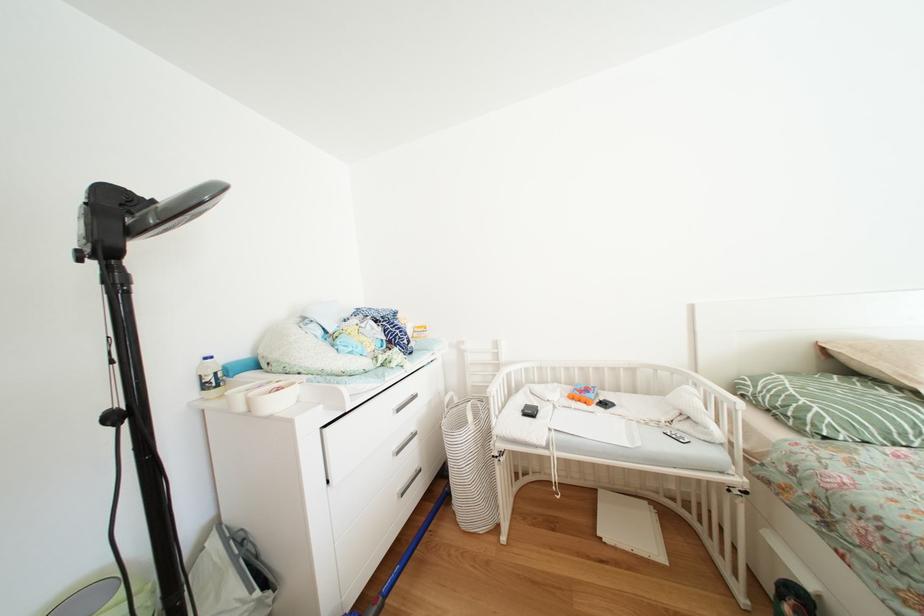
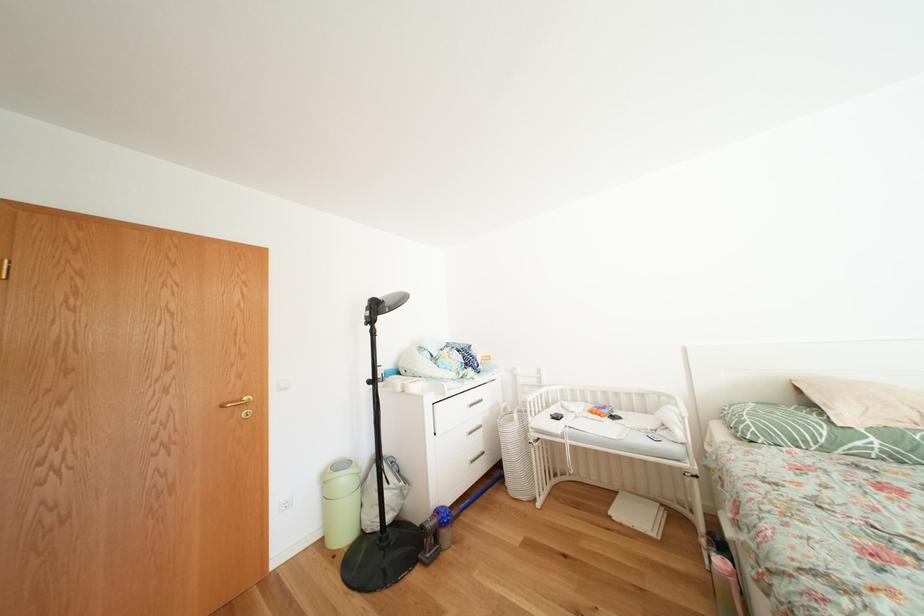
Question: Based on the continuous images, in which direction is the camera rotating? Reply with the corresponding letter.

Choices:
 (A) Left
 (B) Right
 (C) Up
 (D) Down

Answer: (A)